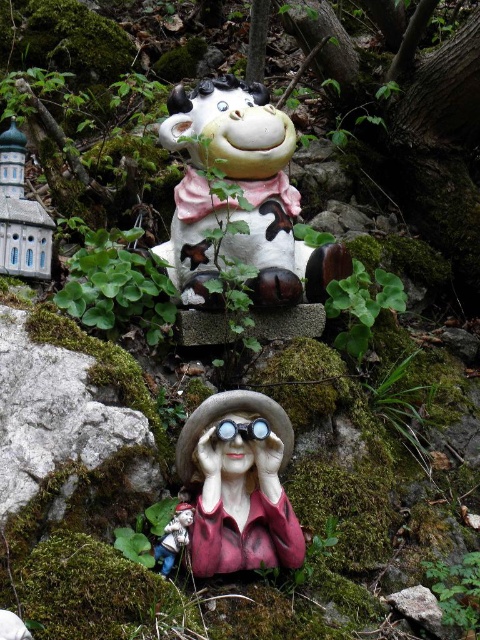
You are a delivery robot with a 10 inch wide package that needs to be placed between the matte ceramic cow at center and the blue painted ceramic tower at left. Can the package fit in the space between them without touching either object?

The matte ceramic cow at center is 12.75 inches away from the blue painted ceramic tower at left. Since the package is 10 inches wide, there is enough space between them to place the package without touching either object.

You are a delivery robot with a 16 inch wide package. You need to place the package between the matte ceramic cow at center and the matte pink porcelain doll at center. Is there enough space between them to fit the package?

The distance between the matte ceramic cow at center and the matte pink porcelain doll at center is 19.29 inches. Since the package is 16 inches wide, there is enough space to fit it between them as 19.29 inches is greater than 16 inches.

You are a child who wants to place both the matte ceramic cow at center and the matte pink porcelain doll at center on a shelf. The shelf has a height limit of 20 cm. If the cow is taller than the doll, will both items fit vertically on the shelf?

The matte ceramic cow at center is taller than the matte pink porcelain doll at center. Since the cow is taller, if its height exceeds 20 cm, both items won me fit. However, if the cow is under 20 cm, both will fit. Without exact measurements, we can only say that the cow must be under 20 cm for both to fit.